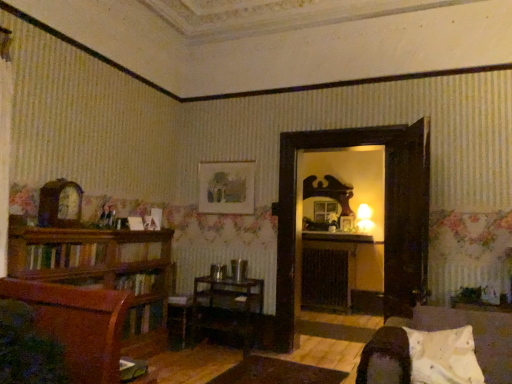
Locate an element on the screen. The height and width of the screenshot is (384, 512). wooden table at center is located at coordinates (227, 306).

Describe the element at coordinates (227, 306) in the screenshot. Image resolution: width=512 pixels, height=384 pixels. I see `wooden table at center` at that location.

Locate an element on the screen. The image size is (512, 384). matte paper picture frame at upper center is located at coordinates (226, 187).

Looking at this image, measure the distance between matte paper picture frame at upper center and camera.

A distance of 4.64 meters exists between matte paper picture frame at upper center and camera.

Measure the distance between velvet dark brown chair at lower right and camera.

velvet dark brown chair at lower right is 6.93 feet away from camera.

Where is `wooden table at center`? The width and height of the screenshot is (512, 384). wooden table at center is located at coordinates (227, 306).

Measure the distance between white soft pillow at lower right and wooden armchair at center.

white soft pillow at lower right and wooden armchair at center are 8.43 feet apart from each other.

This screenshot has width=512, height=384. I want to click on pillow that appears in front of the wooden armchair at center, so click(x=443, y=357).

Can you confirm if white soft pillow at lower right is positioned to the right of wooden armchair at center?

Correct, you'll find white soft pillow at lower right to the right of wooden armchair at center.

Is black matte fireplace at center inside or outside of matte paper picture frame at upper center?

black matte fireplace at center is located beyond the bounds of matte paper picture frame at upper center.

Between black matte fireplace at center and matte paper picture frame at upper center, which one has larger width?

Wider between the two is black matte fireplace at center.

Is black matte fireplace at center in front of or behind matte paper picture frame at upper center in the image?

black matte fireplace at center is positioned farther from the viewer than matte paper picture frame at upper center.

This screenshot has height=384, width=512. I want to click on picture frame to the left of velvet dark brown chair at lower right, so click(226, 187).

From a real-world perspective, is velvet dark brown chair at lower right located beneath matte paper picture frame at upper center?

Correct, in the physical world, velvet dark brown chair at lower right is lower than matte paper picture frame at upper center.

Considering the points (504, 362) and (221, 198), which point is in front, point (504, 362) or point (221, 198)?

Positioned in front is point (504, 362).

Based on their sizes in the image, would you say velvet dark brown chair at lower right is bigger or smaller than matte paper picture frame at upper center?

velvet dark brown chair at lower right is bigger than matte paper picture frame at upper center.

From a real-world perspective, between matte paper picture frame at upper center and black matte fireplace at center, who is vertically higher?

matte paper picture frame at upper center.

Is matte paper picture frame at upper center to the left of black matte fireplace at center from the viewer's perspective?

Correct, you'll find matte paper picture frame at upper center to the left of black matte fireplace at center.

Who is shorter, matte paper picture frame at upper center or black matte fireplace at center?

matte paper picture frame at upper center.

Which object is closer to the camera taking this photo, velvet dark brown chair at lower right or black matte fireplace at center?

velvet dark brown chair at lower right is in front.

Looking at their sizes, would you say velvet dark brown chair at lower right is wider or thinner than black matte fireplace at center?

Considering their sizes, velvet dark brown chair at lower right looks broader than black matte fireplace at center.

Which object is closer to the camera, matte paper picture frame at upper center or wooden table at center?

wooden table at center is in front.

At what (x,y) coordinates should I click in order to perform the action: click on picture frame that is above the wooden table at center (from the image's perspective). Please return your answer as a coordinate pair (x, y). The image size is (512, 384). Looking at the image, I should click on (226, 187).

Would you say matte paper picture frame at upper center is a long distance from wooden table at center?

Yes.

Does matte paper picture frame at upper center have a smaller size compared to wooden table at center?

Yes.

From a real-world perspective, is black matte fireplace at center beneath mahogany wood bookshelf at left?

Yes, from a real-world perspective, black matte fireplace at center is below mahogany wood bookshelf at left.

Is point (303, 300) in front of point (54, 260)?

That is False.

Is black matte fireplace at center wider or thinner than mahogany wood bookshelf at left?

Clearly, black matte fireplace at center has less width compared to mahogany wood bookshelf at left.

You are a GUI agent. You are given a task and a screenshot of the screen. Output one action in this format:
    pyautogui.click(x=<x>, y=<y>)
    Task: Click on the armchair that appears on the left of white soft pillow at lower right
    
    Given the screenshot: What is the action you would take?
    pyautogui.click(x=178, y=314)

Find the location of a particular element. Image resolution: width=512 pixels, height=384 pixels. picture frame above the black matte fireplace at center (from the image's perspective) is located at coordinates (226, 187).

Which object lies nearer to the anchor point white soft pillow at lower right, black matte fireplace at center or mahogany wood bookshelf at left?

mahogany wood bookshelf at left lies closer to white soft pillow at lower right than the other object.

When comparing their distances from black matte fireplace at center, does mahogany wood bookshelf at left or velvet dark brown chair at lower right seem closer?

mahogany wood bookshelf at left lies closer to black matte fireplace at center than the other object.

From the image, which object appears to be farther from white soft pillow at lower right, wooden armchair at center or wooden table at center?

Among the two, wooden armchair at center is located further to white soft pillow at lower right.

Which object lies nearer to the anchor point wooden armchair at center, velvet dark brown chair at lower right or white soft pillow at lower right?

velvet dark brown chair at lower right is positioned closer to the anchor wooden armchair at center.

Estimate the real-world distances between objects in this image. Which object is closer to white soft pillow at lower right, velvet dark brown chair at lower right or matte paper picture frame at upper center?

velvet dark brown chair at lower right.

Based on the photo, from the image, which object appears to be nearer to wooden armchair at center, white soft pillow at lower right or velvet dark brown chair at lower right?

Based on the image, velvet dark brown chair at lower right appears to be nearer to wooden armchair at center.

From the image, which object appears to be farther from wooden table at center, black matte fireplace at center or velvet dark brown chair at lower right?

velvet dark brown chair at lower right lies further to wooden table at center than the other object.

Which object lies nearer to the anchor point white soft pillow at lower right, velvet dark brown chair at lower right or wooden armchair at center?

velvet dark brown chair at lower right lies closer to white soft pillow at lower right than the other object.

Locate an element on the screen. This screenshot has height=384, width=512. table located between velvet dark brown chair at lower right and matte paper picture frame at upper center in the depth direction is located at coordinates (227, 306).

Where is `armchair between mahogany wood bookshelf at left and black matte fireplace at center from front to back`? This screenshot has height=384, width=512. armchair between mahogany wood bookshelf at left and black matte fireplace at center from front to back is located at coordinates (178, 314).

Find the location of a particular element. armchair between velvet dark brown chair at lower right and black matte fireplace at center along the z-axis is located at coordinates (178, 314).

Where is `armchair located between velvet dark brown chair at lower right and matte paper picture frame at upper center in the depth direction`? The width and height of the screenshot is (512, 384). armchair located between velvet dark brown chair at lower right and matte paper picture frame at upper center in the depth direction is located at coordinates (178, 314).